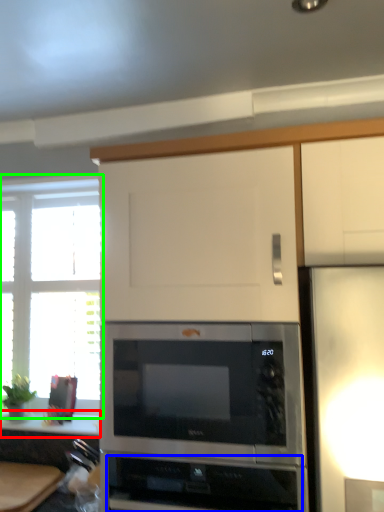
Question: Which object is positioned closest to counter top (highlighted by a red box)? Select from appliance (highlighted by a blue box) and window (highlighted by a green box).

Choices:
 (A) appliance
 (B) window

Answer: (B)